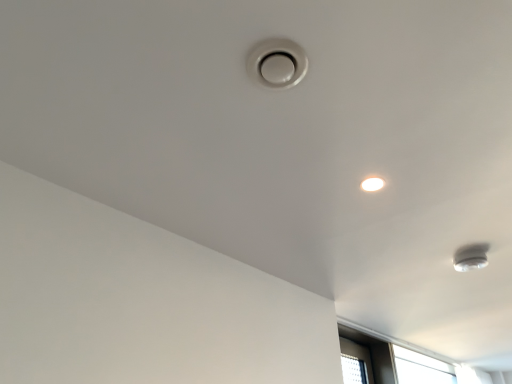
Question: Based on their positions, is white glossy droplight at upper right located to the left or right of white glossy lamp at lower right?

Choices:
 (A) right
 (B) left

Answer: (B)

Question: In terms of width, does white glossy droplight at upper right look wider or thinner when compared to white glossy lamp at lower right?

Choices:
 (A) thin
 (B) wide

Answer: (A)

Question: Choose the correct answer: Is white glossy droplight at upper right inside white glossy lamp at lower right or outside it?

Choices:
 (A) outside
 (B) inside

Answer: (A)

Question: In terms of size, does white glossy lamp at lower right appear bigger or smaller than white glossy droplight at upper right?

Choices:
 (A) big
 (B) small

Answer: (A)

Question: From the image's perspective, is white glossy lamp at lower right above or below white glossy droplight at upper right?

Choices:
 (A) below
 (B) above

Answer: (A)

Question: Choose the correct answer: Is white glossy lamp at lower right inside white glossy droplight at upper right or outside it?

Choices:
 (A) inside
 (B) outside

Answer: (B)

Question: Is white glossy lamp at lower right wider or thinner than white glossy droplight at upper right?

Choices:
 (A) wide
 (B) thin

Answer: (A)